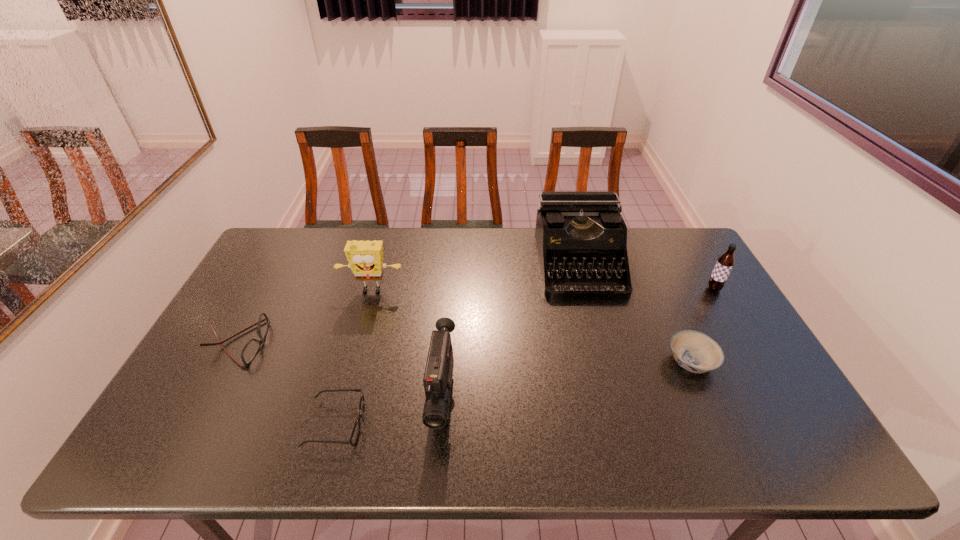
The image size is (960, 540). Identify the location of free space located on the front of the rightmost object. (761, 369).

I want to click on vacant area located on the left of the second object from right to left, so click(x=607, y=362).

The width and height of the screenshot is (960, 540). I want to click on vacant area situated 0.140m on the front-facing side of the farther spectacles, so click(x=314, y=343).

Find the location of `vacant area located on the front-facing side of the right spectacles`. vacant area located on the front-facing side of the right spectacles is located at coordinates (457, 424).

The width and height of the screenshot is (960, 540). Identify the location of object present at the far edge. (583, 231).

Where is `camcorder situated at the near edge`? camcorder situated at the near edge is located at coordinates (437, 380).

Identify the location of spectacles that is positioned at the near edge. The height and width of the screenshot is (540, 960). (355, 433).

Locate an element on the screen. The image size is (960, 540). object located at the left edge is located at coordinates (250, 350).

Where is `root beer situated at the right edge`? The image size is (960, 540). root beer situated at the right edge is located at coordinates (x=725, y=263).

I want to click on bowl present at the right edge, so click(x=696, y=352).